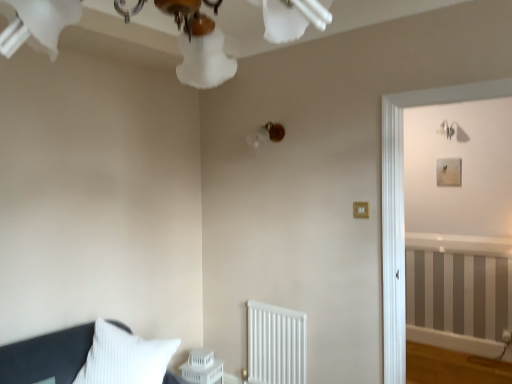
Question: Is point pyautogui.click(x=298, y=339) closer or farther from the camera than point pyautogui.click(x=18, y=26)?

Choices:
 (A) closer
 (B) farther

Answer: (B)

Question: In terms of size, does white matte radiator at lower center appear bigger or smaller than white frosted glass chandelier at upper center?

Choices:
 (A) big
 (B) small

Answer: (B)

Question: Which of these objects is positioned farthest from the gold metallic light switch at center-right?

Choices:
 (A) white plastic table at lower center
 (B) white frosted glass chandelier at upper center
 (C) white matte radiator at lower center
 (D) matte brown lampshade at upper center

Answer: (B)

Question: Which object is positioned closest to the gold metallic light switch at center-right?

Choices:
 (A) white plastic table at lower center
 (B) white matte radiator at lower center
 (C) matte brown lampshade at upper center
 (D) white frosted glass chandelier at upper center

Answer: (C)